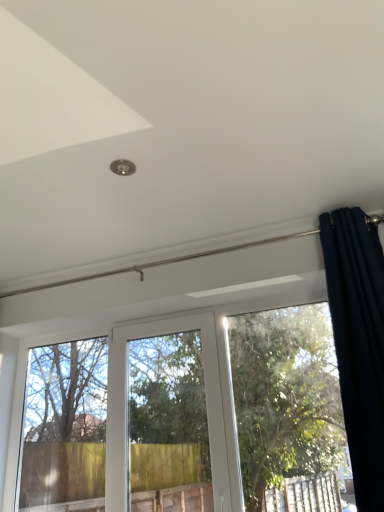
Question: Should I look upward or downward to see dark blue velvet curtain at upper right?

Choices:
 (A) up
 (B) down

Answer: (B)

Question: Can you confirm if green leafy tree at lower center is thinner than dark blue velvet curtain at upper right?

Choices:
 (A) yes
 (B) no

Answer: (A)

Question: Is green leafy tree at lower center positioned beyond the bounds of dark blue velvet curtain at upper right?

Choices:
 (A) no
 (B) yes

Answer: (B)

Question: Is green leafy tree at lower center beside dark blue velvet curtain at upper right?

Choices:
 (A) yes
 (B) no

Answer: (B)

Question: Considering the relative positions of green leafy tree at lower center and dark blue velvet curtain at upper right in the image provided, is green leafy tree at lower center to the left of dark blue velvet curtain at upper right from the viewer's perspective?

Choices:
 (A) no
 (B) yes

Answer: (B)

Question: Considering the relative sizes of green leafy tree at lower center and dark blue velvet curtain at upper right in the image provided, is green leafy tree at lower center taller than dark blue velvet curtain at upper right?

Choices:
 (A) yes
 (B) no

Answer: (B)

Question: From the image's perspective, is green leafy tree at lower center located beneath dark blue velvet curtain at upper right?

Choices:
 (A) no
 (B) yes

Answer: (B)

Question: Is dark blue velvet curtain at upper right wider than green leafy tree at lower center?

Choices:
 (A) no
 (B) yes

Answer: (B)

Question: Is dark blue velvet curtain at upper right further to the viewer compared to green leafy tree at lower center?

Choices:
 (A) no
 (B) yes

Answer: (A)

Question: Is dark blue velvet curtain at upper right placed right next to green leafy tree at lower center?

Choices:
 (A) no
 (B) yes

Answer: (A)

Question: Does dark blue velvet curtain at upper right lie in front of green leafy tree at lower center?

Choices:
 (A) yes
 (B) no

Answer: (A)

Question: Would you say dark blue velvet curtain at upper right is outside green leafy tree at lower center?

Choices:
 (A) yes
 (B) no

Answer: (A)

Question: Considering the relative sizes of dark blue velvet curtain at upper right and green leafy tree at lower center in the image provided, is dark blue velvet curtain at upper right thinner than green leafy tree at lower center?

Choices:
 (A) yes
 (B) no

Answer: (B)

Question: Considering the positions of dark blue velvet curtain at upper right and green leafy tree at lower center in the image, is dark blue velvet curtain at upper right bigger or smaller than green leafy tree at lower center?

Choices:
 (A) big
 (B) small

Answer: (B)